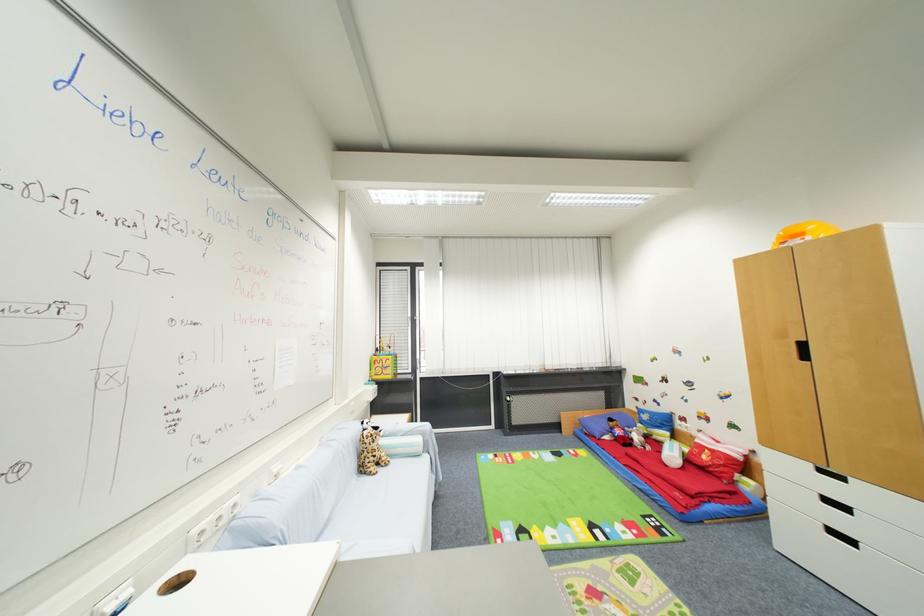
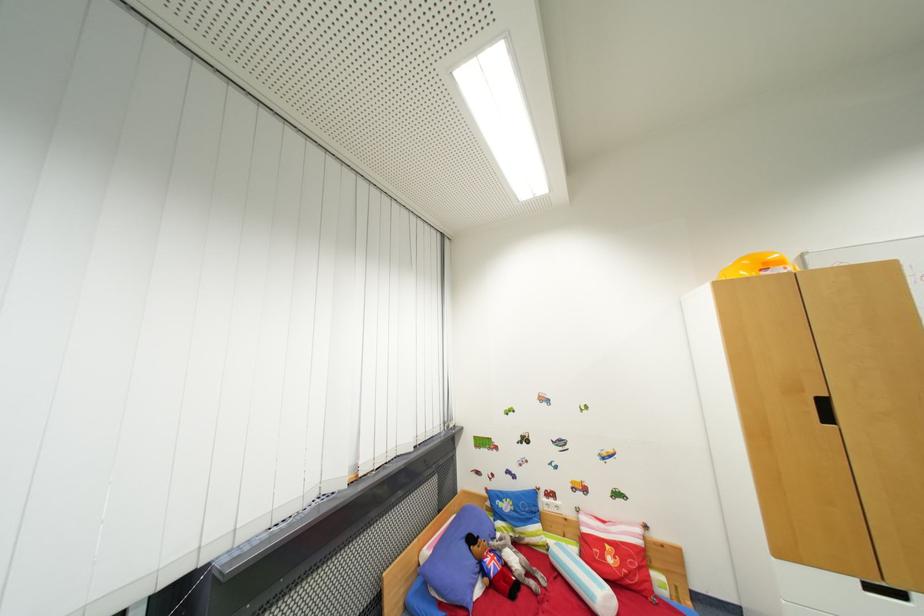
The point at (676, 459) is marked in the first image. Where is the corresponding point in the second image?

(605, 596)